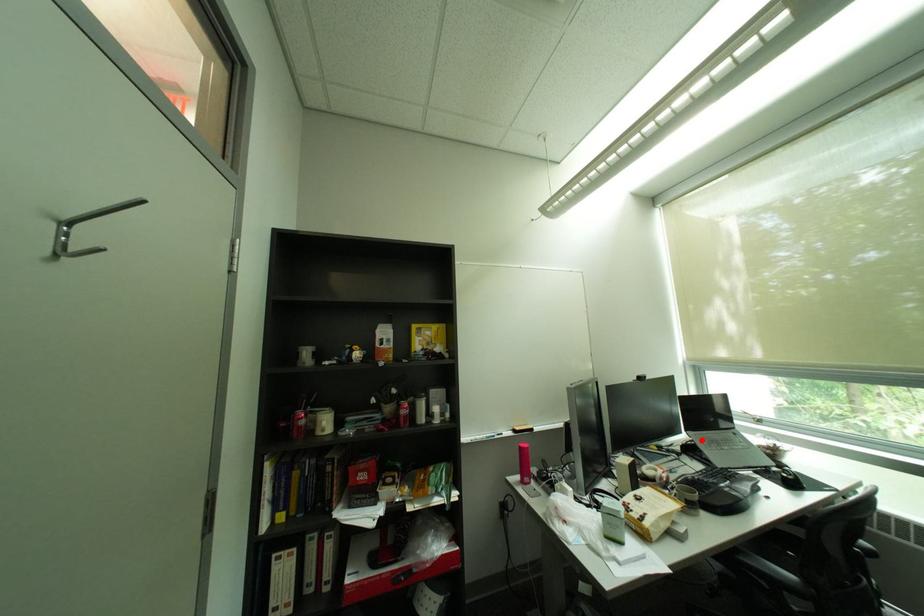
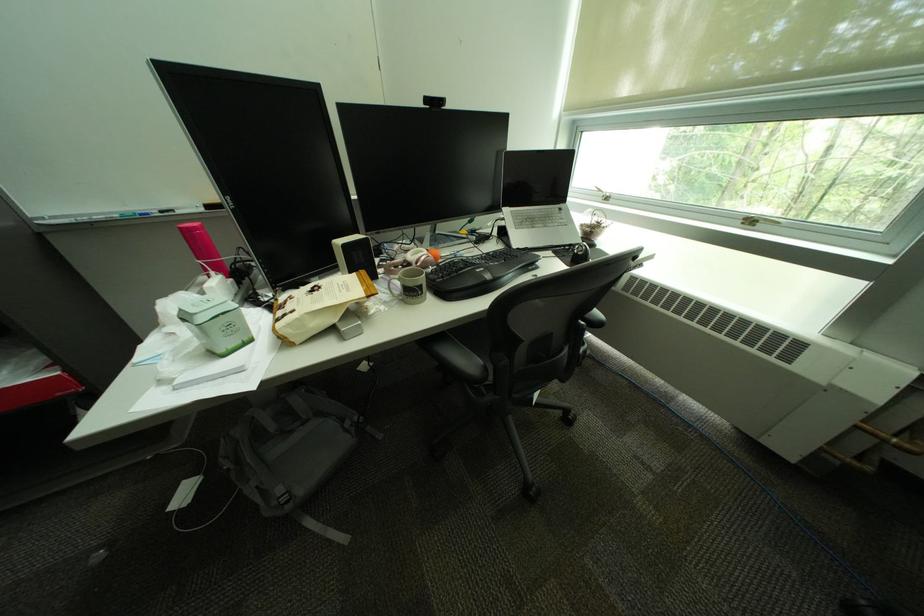
Where in the second image is the point corresponding to the highlighted location from the first image?

(514, 217)